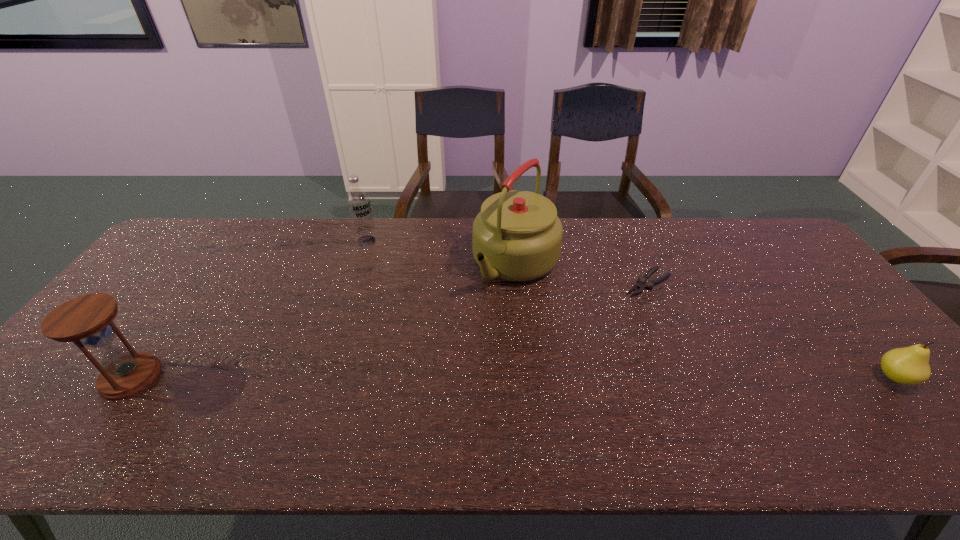
The width and height of the screenshot is (960, 540). Identify the location of the leftmost object. (87, 320).

Locate an element on the screen. pear is located at coordinates (910, 365).

Where is `the rightmost object`? This screenshot has width=960, height=540. the rightmost object is located at coordinates (910, 365).

Identify the location of kettle. Image resolution: width=960 pixels, height=540 pixels. (517, 236).

Locate an element on the screen. The image size is (960, 540). the tallest object is located at coordinates (517, 236).

Where is `vodka`? The height and width of the screenshot is (540, 960). vodka is located at coordinates (358, 203).

Find the location of a particular element. This screenshot has width=960, height=540. pliers is located at coordinates (641, 285).

The image size is (960, 540). I want to click on the shortest object, so click(x=641, y=285).

The image size is (960, 540). Identify the location of blank area located on the back of the leftmost object. (179, 310).

Where is `vacant space located on the left of the second shortest object`? vacant space located on the left of the second shortest object is located at coordinates (827, 377).